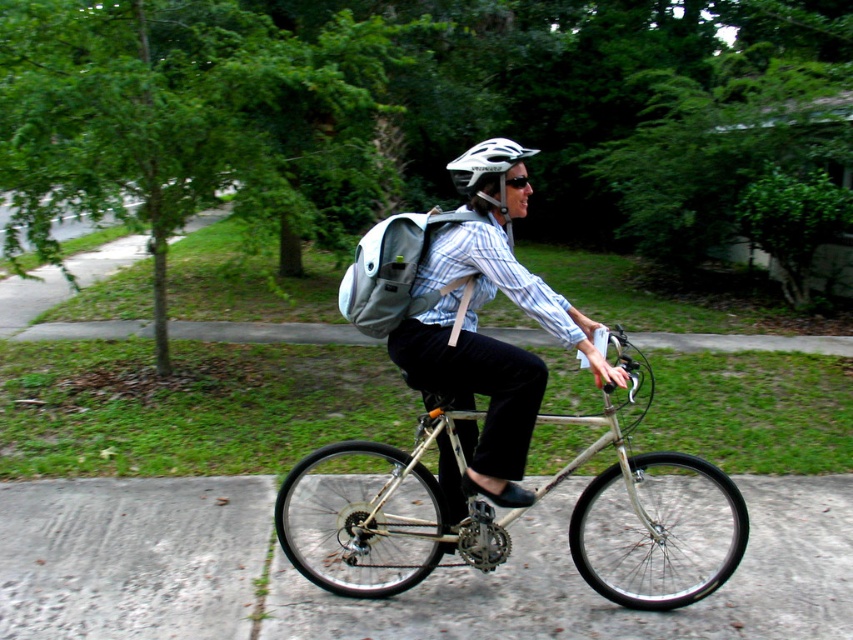
Question: Can you confirm if silver metallic bicycle at center is positioned to the right of white matte bicycle helmet at center?

Choices:
 (A) yes
 (B) no

Answer: (B)

Question: Is matte gray backpack at center behind white matte bicycle helmet at center?

Choices:
 (A) yes
 (B) no

Answer: (B)

Question: Does silver metallic bicycle at center come behind white matte bicycle helmet at center?

Choices:
 (A) no
 (B) yes

Answer: (A)

Question: Which of the following is the farthest from the observer?

Choices:
 (A) (447, 163)
 (B) (679, 570)

Answer: (A)

Question: Which point is farther from the camera taking this photo?

Choices:
 (A) (479, 172)
 (B) (471, 472)
 (C) (546, 483)

Answer: (C)

Question: Which point is farther to the camera?

Choices:
 (A) (469, 182)
 (B) (515, 372)
 (C) (434, 504)

Answer: (C)